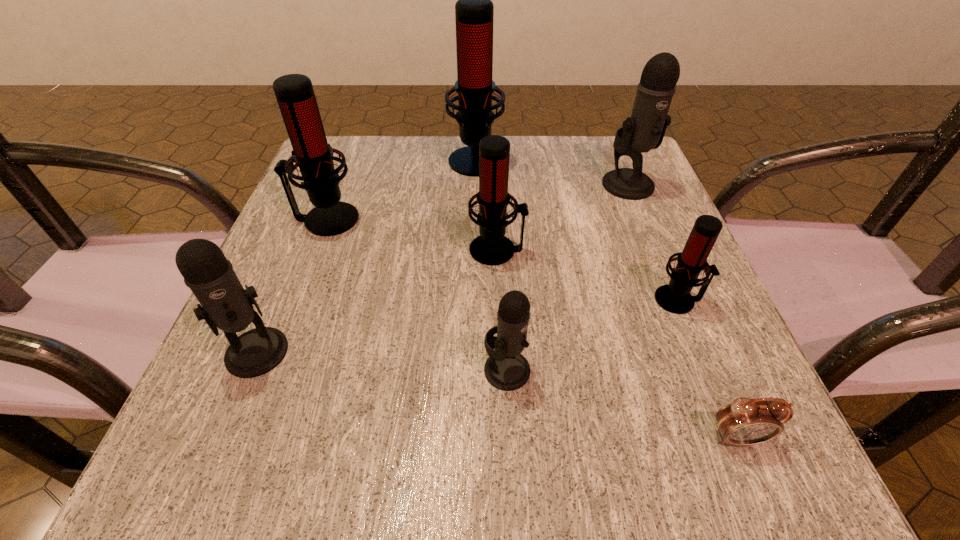
Locate an element on the screen. The height and width of the screenshot is (540, 960). the tallest object is located at coordinates pos(474,11).

You are a GUI agent. You are given a task and a screenshot of the screen. Output one action in this format:
    pyautogui.click(x=<x>, y=<y>)
    Task: Click on the tallest microphone
    The height and width of the screenshot is (540, 960).
    Given the screenshot: What is the action you would take?
    pyautogui.click(x=474, y=11)

Find the location of `the rightmost black microphone`. the rightmost black microphone is located at coordinates (645, 129).

At what (x,y) coordinates should I click in order to perform the action: click on the farthest black microphone. Please return your answer as a coordinate pair (x, y). Looking at the image, I should click on (645, 129).

Where is `the leftmost red microphone`? the leftmost red microphone is located at coordinates (295, 95).

Identify the location of the third biggest red microphone. (492, 248).

The height and width of the screenshot is (540, 960). I want to click on the leftmost black microphone, so click(225, 304).

Locate an element on the screen. This screenshot has width=960, height=540. the third nearest microphone is located at coordinates (675, 297).

Where is `the smallest red microphone`? the smallest red microphone is located at coordinates (675, 297).

Locate an element on the screen. the second black microphone from left to right is located at coordinates (506, 369).